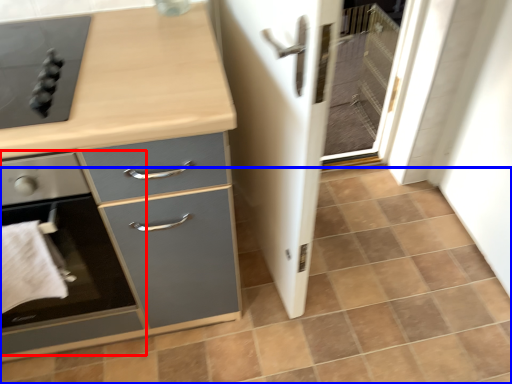
Question: Among these objects, which one is farthest to the camera, home appliance (highlighted by a red box) or tile (highlighted by a blue box)?

Choices:
 (A) home appliance
 (B) tile

Answer: (B)